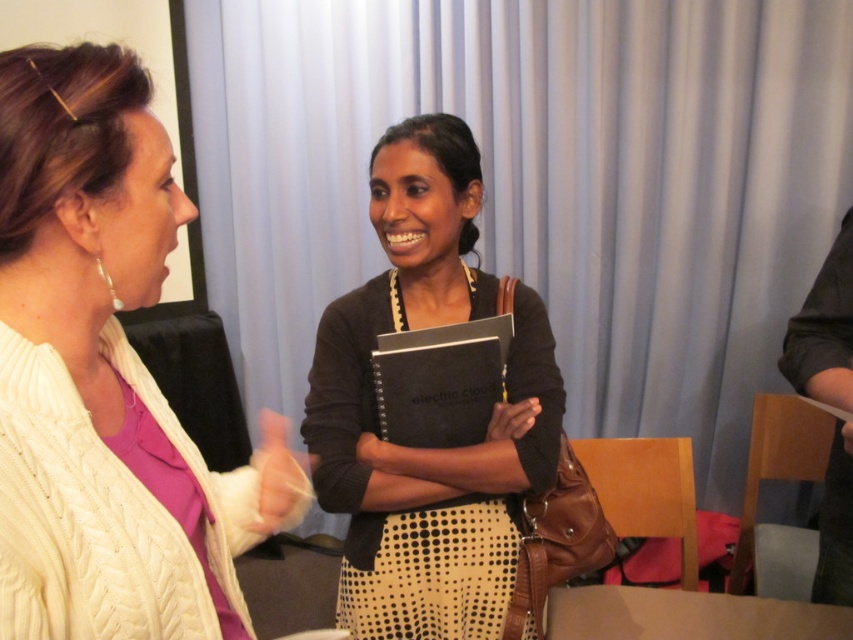
Which is in front, point (111, 397) or point (517, 429)?

Point (111, 397)

Is point (137, 502) farther from viewer compared to point (537, 403)?

No, (137, 502) is closer to viewer.

Looking at this image, who is more forward, (273, 451) or (529, 417)?

Point (273, 451) is more forward.

Identify the location of white cable-knit sweater at left. The image size is (853, 640). click(x=103, y=372).

Is point (102, 240) closer to camera compared to point (433, 572)?

That is True.

Is white cable-knit sweater at left to the right of black matte notebook at center from the viewer's perspective?

In fact, white cable-knit sweater at left is to the left of black matte notebook at center.

Which is behind, point (138, 77) or point (462, 522)?

The point (462, 522) is more distant.

Find the location of a particular element. The image size is (853, 640). white cable-knit sweater at left is located at coordinates (103, 372).

Can you confirm if black matte notebook at center is thinner than yellow matte hand at center?

In fact, black matte notebook at center might be wider than yellow matte hand at center.

Which is more to the right, black matte notebook at center or yellow matte hand at center?

yellow matte hand at center

This screenshot has height=640, width=853. What do you see at coordinates (425, 449) in the screenshot?
I see `black matte notebook at center` at bounding box center [425, 449].

Find the location of `black matte notebook at center`. black matte notebook at center is located at coordinates (425, 449).